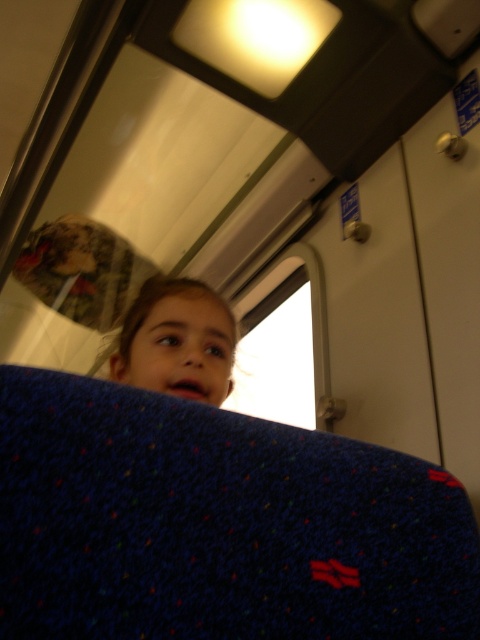
You are sitting on the blue seat with small red dots and a larger red H design. You want to look out the transparent glass window at upper center. In which direction should you turn your head to face the window?

Since the transparent glass window at upper center is located at point (280, 346), you should turn your head upwards and to your right to face the window.

You are sitting in the train carriage and want to check the time using the window. Since the window is at upper center, can you see the time on your watch while looking at the transparent glass window at upper center and the matte blue fabric at upper center?

The transparent glass window at upper center is larger than the matte blue fabric at upper center, so yes, you can see the time on your watch by looking at the transparent glass window at upper center because its larger size allows for better visibility.

You are sitting on the blue seat with small red dots and a larger red H design in a train carriage. You notice a point marked at coordinates (280, 346). What object is located at that point?

The point at coordinates (280, 346) indicates a transparent glass window at upper center.